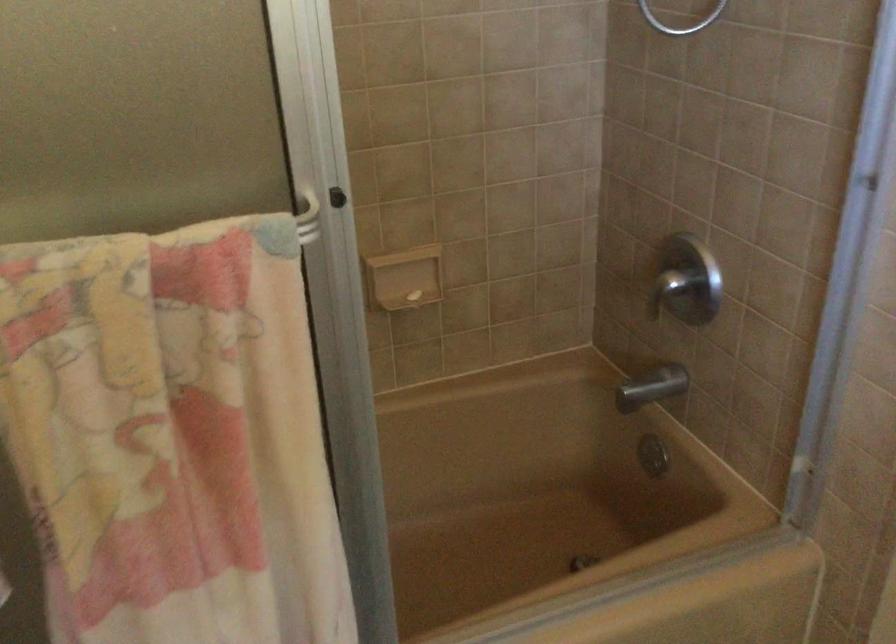
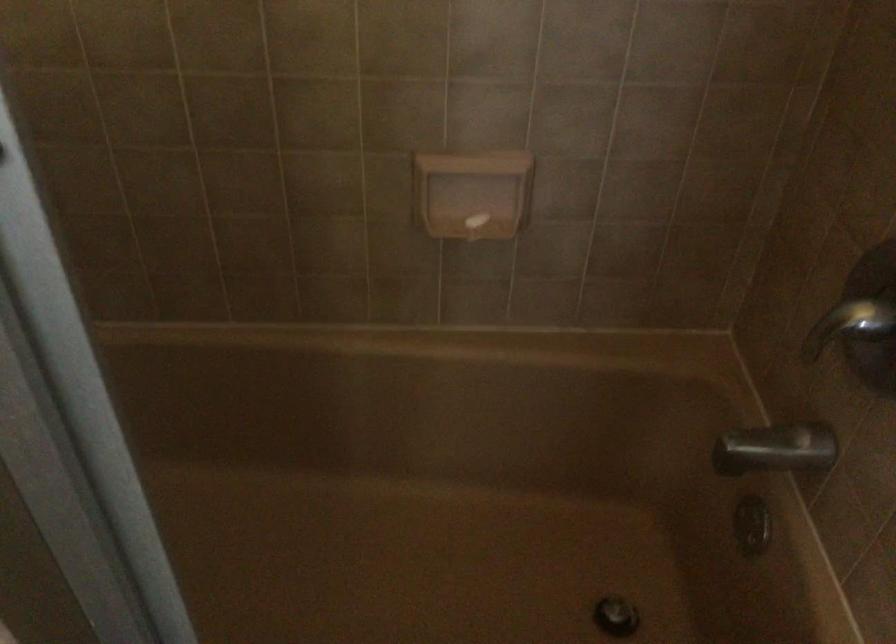
Find the pixel in the second image that matches point 670,289 in the first image.

(849, 325)